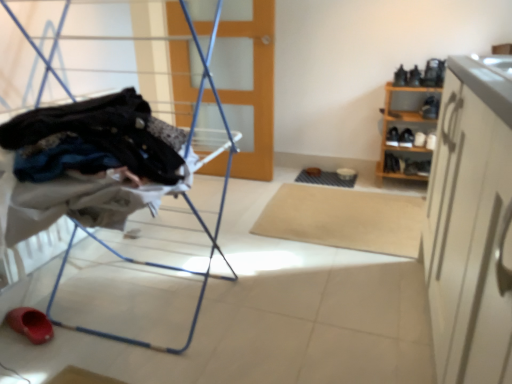
Image resolution: width=512 pixels, height=384 pixels. In order to click on vacant area that is situated to the right of rubber/soft sole shoe at lower left in this screenshot , I will do `click(80, 321)`.